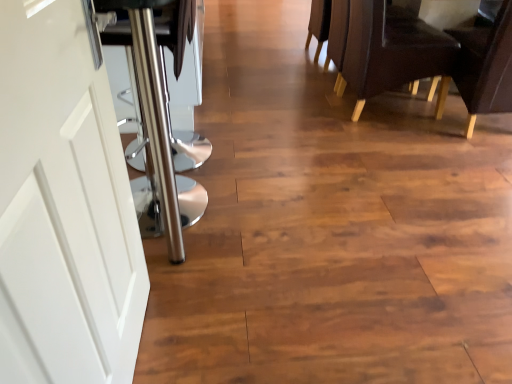
Question: Do you think white matte door at left is within brown leather chair at upper right, the 2th chair when ordered from left to right, or outside of it?

Choices:
 (A) inside
 (B) outside

Answer: (B)

Question: In terms of size, does white matte door at left appear bigger or smaller than brown leather chair at upper right, marked as the 1th chair in a right-to-left arrangement?

Choices:
 (A) small
 (B) big

Answer: (A)

Question: Which object is the farthest from the brown leather chair at upper right, the 2th chair when ordered from left to right?

Choices:
 (A) leather-like dark brown chair at right, which is the 2th chair from right to left
 (B) white matte door at left

Answer: (B)

Question: Which object is the farthest from the brown leather chair at upper right, marked as the 1th chair in a right-to-left arrangement?

Choices:
 (A) white matte door at left
 (B) leather-like dark brown chair at right, which is the 2th chair from right to left

Answer: (A)